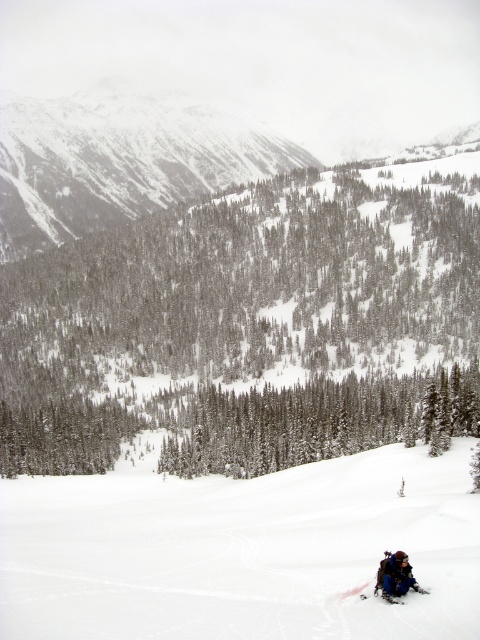
You are standing at the center of the image and want to reach the white snow ski slope at lower right. Which direction should you move in to get there?

You should move towards the lower right direction to reach the white snow ski slope at lower right.

You are a hiker planning to take a photo of the snowy rocky mountain at upper left. You are currently standing at the point marked by coordinates point (119, 163). Can you see the snowy rocky mountain at upper left from your current position?

The snowy rocky mountain at upper left is represented by point (119, 163), so you are standing at the same location as the mountain. Therefore, you cannot see the snowy rocky mountain at upper left from your current position.